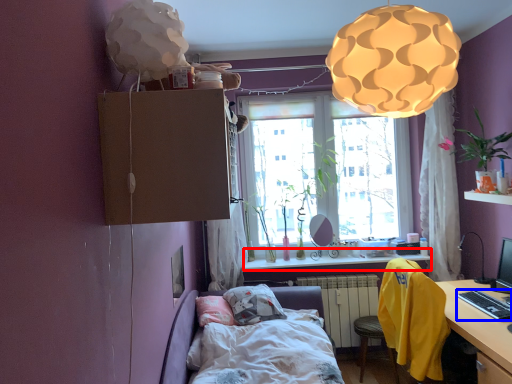
Question: Among these objects, which one is nearest to the camera, window sill (highlighted by a red box) or desktop (highlighted by a blue box)?

Choices:
 (A) window sill
 (B) desktop

Answer: (B)